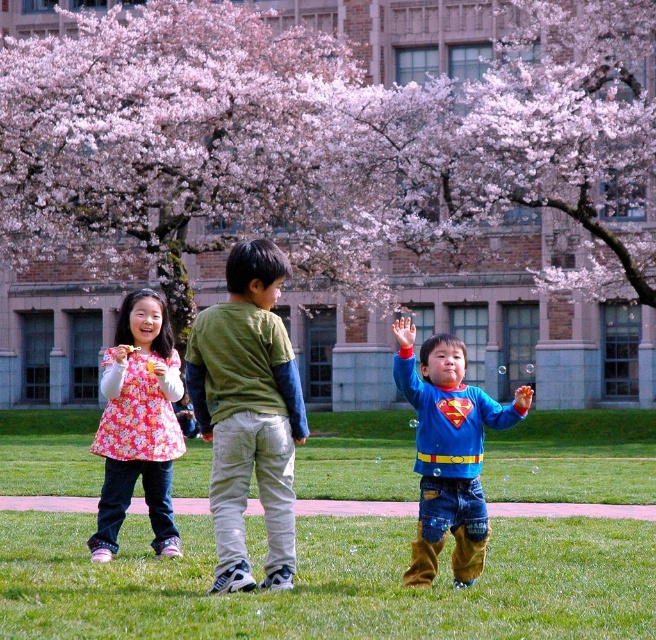
Can you confirm if pink blossom tree at upper center is smaller than floral fabric dress at left?

Incorrect, pink blossom tree at upper center is not smaller in size than floral fabric dress at left.

Measure the distance between point (649, 280) and camera.

Point (649, 280) is 131.09 feet away from camera.

Is point (237, 230) farther from camera compared to point (174, 362)?

Yes, it is behind point (174, 362).

This screenshot has height=640, width=656. I want to click on pink blossom tree at upper center, so click(331, 147).

From the picture: Between pink blossom tree at upper center and blue cotton shirt at center, which one is positioned lower?

blue cotton shirt at center is lower down.

Can you confirm if pink blossom tree at upper center is taller than blue cotton shirt at center?

Yes, pink blossom tree at upper center is taller than blue cotton shirt at center.

Does point (434, 48) come closer to viewer compared to point (434, 394)?

No, (434, 48) is further to viewer.

Find the location of `pink blossom tree at upper center`. pink blossom tree at upper center is located at coordinates (331, 147).

Measure the distance from green grass at center to green cotton shirt at center.

They are 16.45 meters apart.

Between point (358, 484) and point (266, 269), which one is positioned in front?

Positioned in front is point (266, 269).

Describe the element at coordinates (331, 582) in the screenshot. Image resolution: width=656 pixels, height=640 pixels. I see `green grass at center` at that location.

Where is `green grass at center`? The height and width of the screenshot is (640, 656). green grass at center is located at coordinates (331, 582).